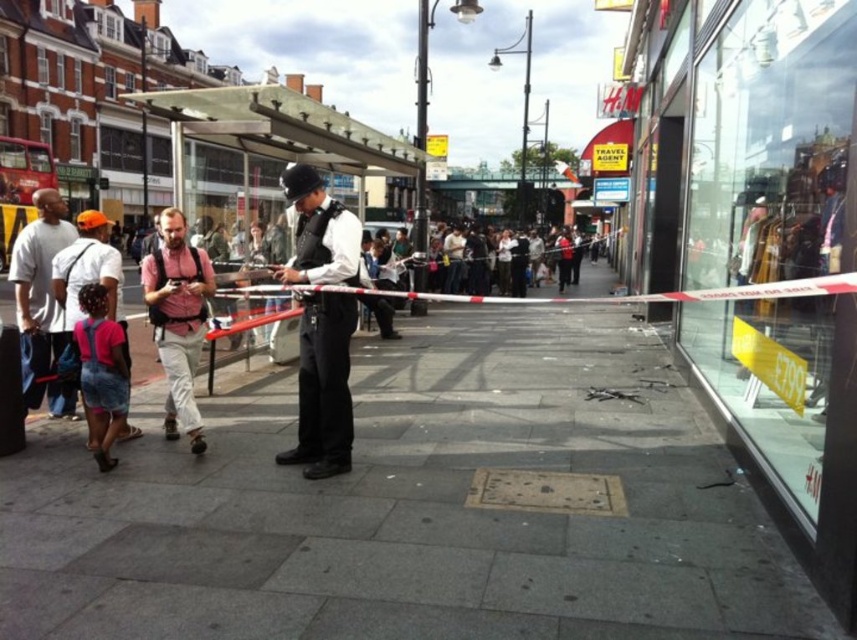
From the picture: Who is positioned more to the right, smooth concrete pavement at center or shiny black helmet at center?

smooth concrete pavement at center is more to the right.

Is smooth concrete pavement at center bigger than shiny black helmet at center?

Correct, smooth concrete pavement at center is larger in size than shiny black helmet at center.

Is point (514, 356) positioned after point (340, 381)?

Yes, it is behind point (340, 381).

Find the location of a particular element. This screenshot has height=640, width=857. smooth concrete pavement at center is located at coordinates (415, 506).

Is transparent plastic bus stop at center wider than matte gray shirt at left?

Correct, the width of transparent plastic bus stop at center exceeds that of matte gray shirt at left.

Who is positioned more to the left, transparent plastic bus stop at center or matte gray shirt at left?

transparent plastic bus stop at center is more to the left.

Describe the element at coordinates (274, 132) in the screenshot. I see `transparent plastic bus stop at center` at that location.

Image resolution: width=857 pixels, height=640 pixels. What are the coordinates of `transparent plastic bus stop at center` in the screenshot? It's located at (274, 132).

Is pink fabric shirt at center shorter than matte gray shirt at left?

Yes, pink fabric shirt at center is shorter than matte gray shirt at left.

Is pink fabric shirt at center taller than matte gray shirt at left?

No.

Between point (172, 406) and point (51, 236), which one is positioned in front?

Point (172, 406)

This screenshot has height=640, width=857. I want to click on pink fabric shirt at center, so click(x=178, y=320).